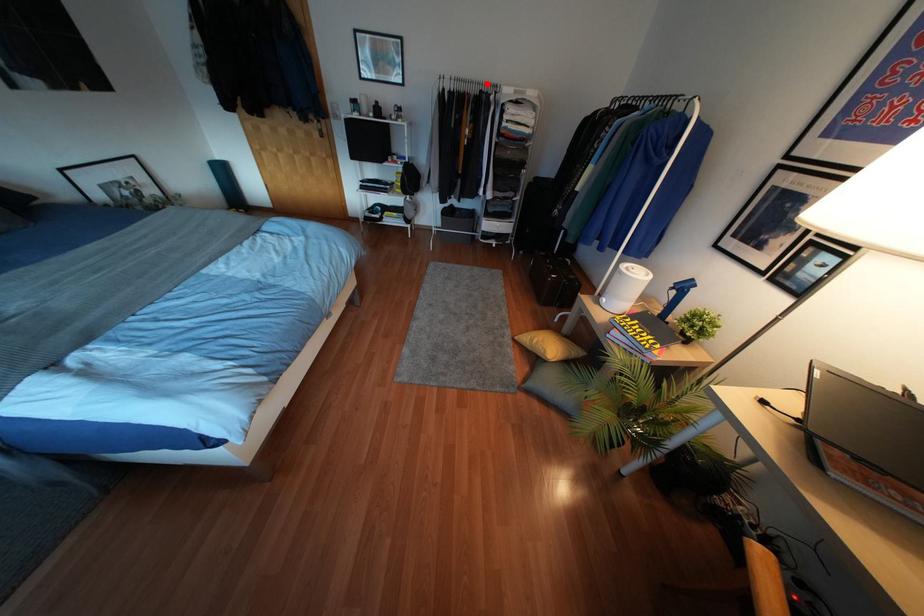
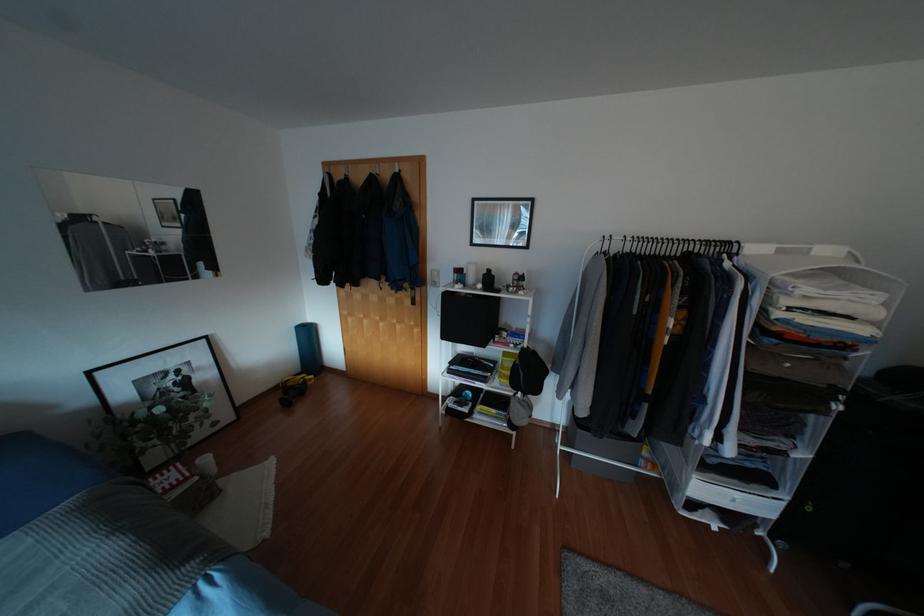
Locate, in the second image, the point that corresponds to the highlighted location in the first image.

(707, 241)